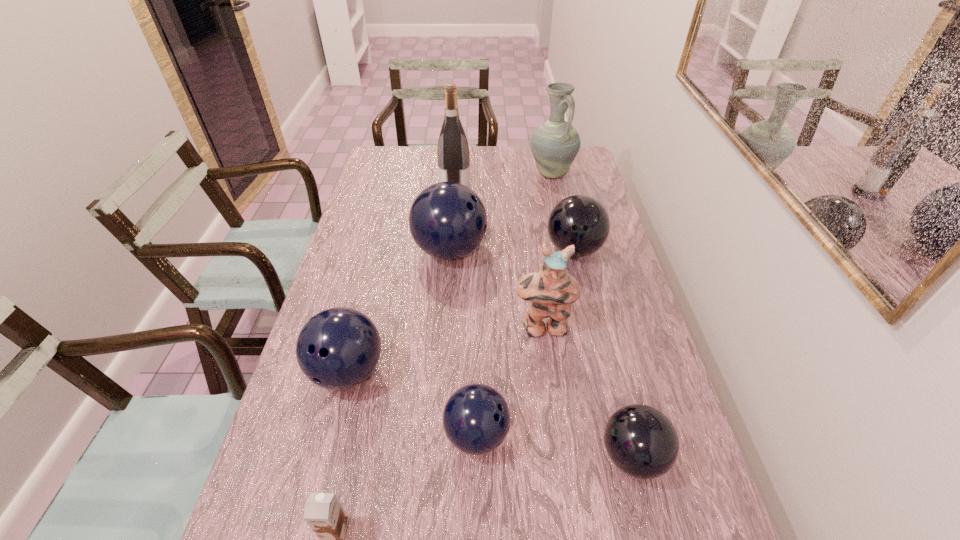
Where is `empty space that is in between the smaller black bowling ball and the figurine`? empty space that is in between the smaller black bowling ball and the figurine is located at coordinates (588, 392).

Locate an element on the screen. This screenshot has width=960, height=540. free spot between the smallest blue bowling ball and the figurine is located at coordinates (510, 381).

Locate an element on the screen. This screenshot has height=540, width=960. free spot between the bigger black bowling ball and the second smallest blue bowling ball is located at coordinates (461, 310).

What are the coordinates of `unoccupied position between the nearer black bowling ball and the pink figurine` in the screenshot? It's located at (588, 392).

At what (x,y) coordinates should I click in order to perform the action: click on free area in between the wine bottle and the leftmost bowling ball. Please return your answer as a coordinate pair (x, y). Image resolution: width=960 pixels, height=540 pixels. Looking at the image, I should click on (401, 282).

I want to click on vacant space that is in between the pink figurine and the smaller black bowling ball, so [588, 392].

Point out which object is positioned as the nearest to the biggest blue bowling ball. Please provide its 2D coordinates. Your answer should be formatted as a tuple, i.e. [(x, y)], where the tuple contains the x and y coordinates of a point satisfying the conditions above.

[(453, 155)]

Locate an element on the screen. The height and width of the screenshot is (540, 960). object that stands as the sixth closest to the bigger black bowling ball is located at coordinates (641, 441).

Locate which bowling ball ranks in proximity to the wine bottle. Please provide its 2D coordinates. Your answer should be formatted as a tuple, i.e. [(x, y)], where the tuple contains the x and y coordinates of a point satisfying the conditions above.

[(447, 220)]

Locate which bowling ball is the closest to the smaller black bowling ball. Please provide its 2D coordinates. Your answer should be formatted as a tuple, i.e. [(x, y)], where the tuple contains the x and y coordinates of a point satisfying the conditions above.

[(476, 419)]